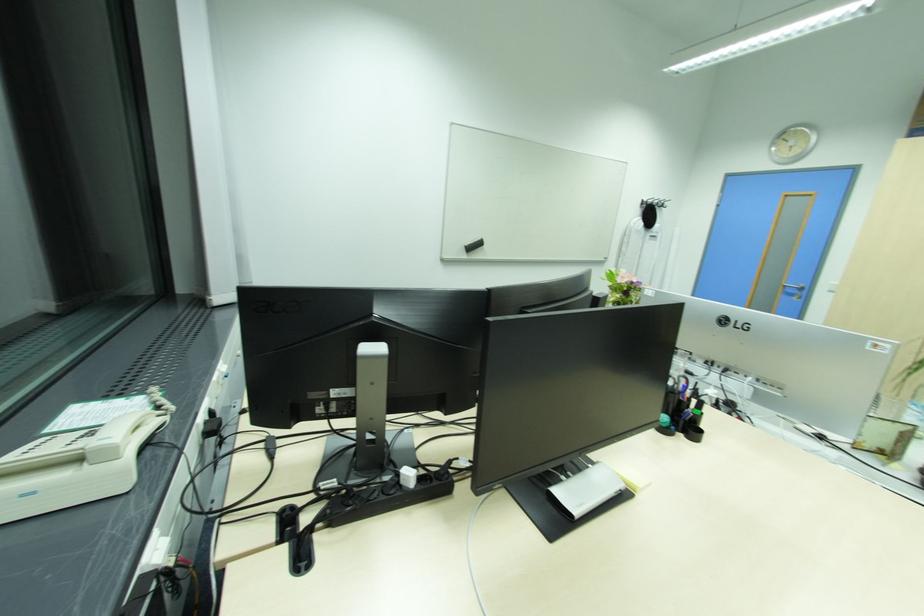
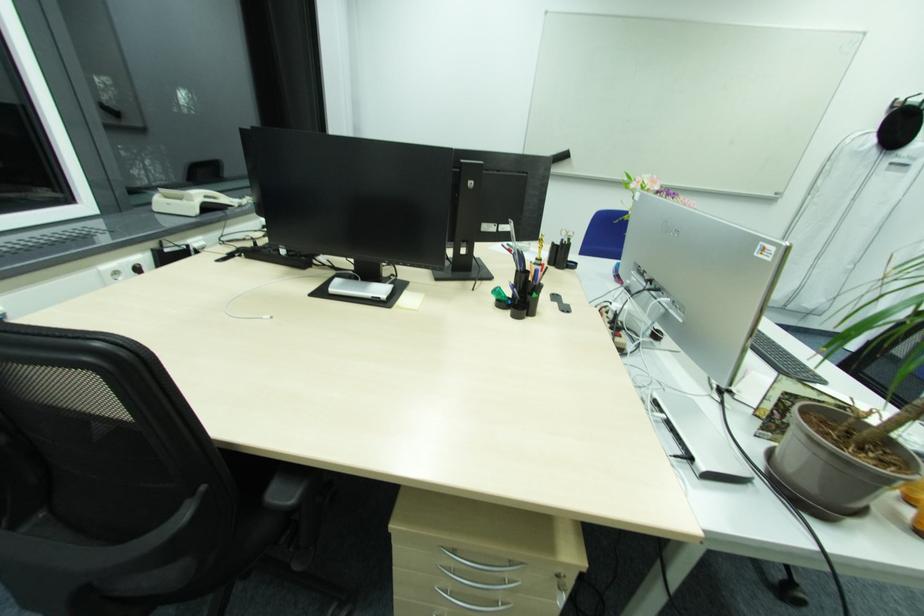
In the second image, find the point that corresponds to pixel 645 217 in the first image.

(881, 130)